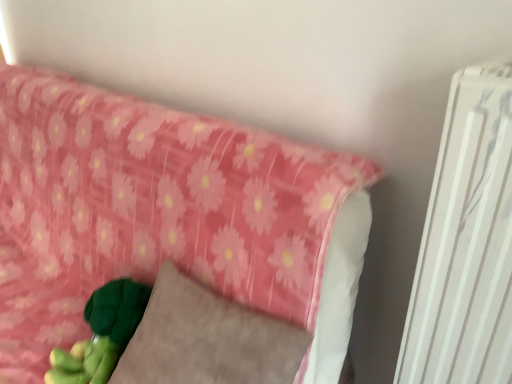
Question: From the image's perspective, relative to pink fabric pillow at upper left, is velvety gray pillow at lower left above or below?

Choices:
 (A) below
 (B) above

Answer: (A)

Question: Is velvety gray pillow at lower left in front of or behind pink fabric pillow at upper left in the image?

Choices:
 (A) behind
 (B) front

Answer: (A)

Question: In terms of height, does velvety gray pillow at lower left look taller or shorter compared to pink fabric pillow at upper left?

Choices:
 (A) short
 (B) tall

Answer: (A)

Question: Considering their positions, is pink fabric pillow at upper left located in front of or behind velvety gray pillow at lower left?

Choices:
 (A) behind
 (B) front

Answer: (B)

Question: In terms of height, does pink fabric pillow at upper left look taller or shorter compared to velvety gray pillow at lower left?

Choices:
 (A) short
 (B) tall

Answer: (B)

Question: Does point (109, 249) appear closer or farther from the camera than point (256, 317)?

Choices:
 (A) farther
 (B) closer

Answer: (A)

Question: Choose the correct answer: Is pink fabric pillow at upper left inside velvety gray pillow at lower left or outside it?

Choices:
 (A) inside
 (B) outside

Answer: (B)